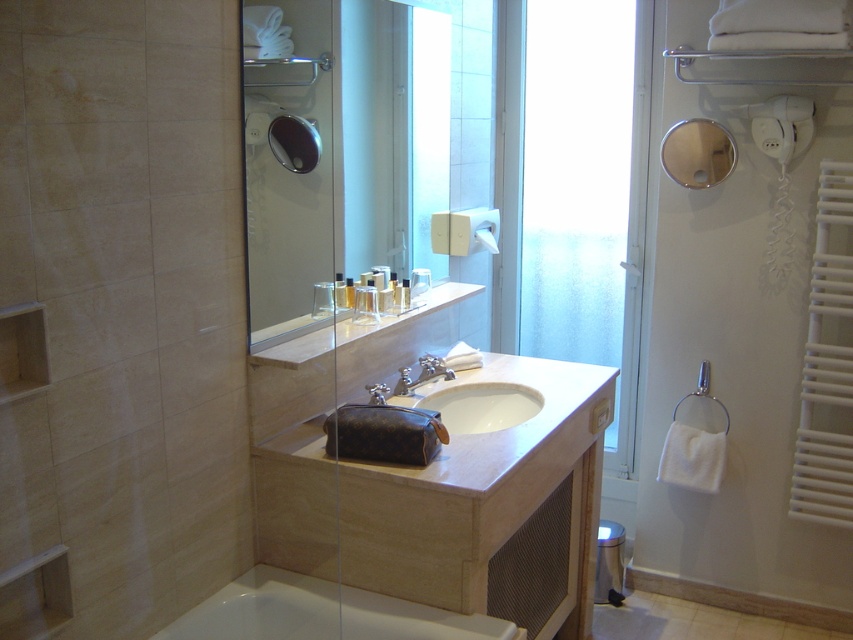
You are designing a bathroom layout and need to place a new decorative item between the frosted glass door at center and the silver metallic faucet at sink center. Given their sizes, which object should you place closer to the smaller one to maintain balance?

The silver metallic faucet at sink center is smaller in width than the frosted glass door at center. To maintain balance, place the decorative item closer to the silver metallic faucet at sink center since it is smaller.

You are a contractor measuring door dimensions for a renovation project. You need to determine which door is taller between the white frosted glass screen door at right and the frosted glass door at center. Based on the scene, which one is taller?

The white frosted glass screen door at right is taller than the frosted glass door at center according to the description.